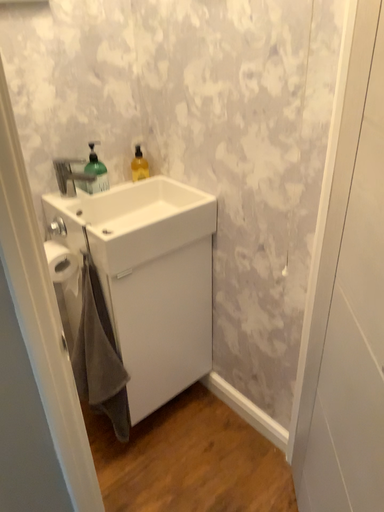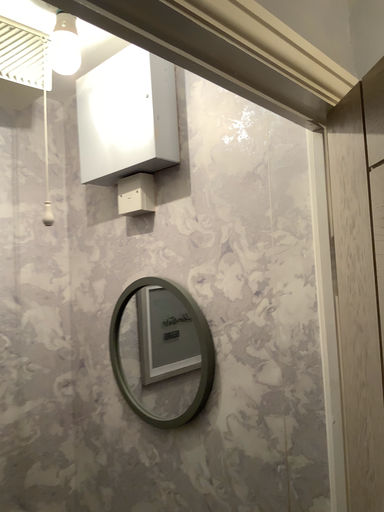
Question: How did the camera likely rotate when shooting the video?

Choices:
 (A) rotated upward
 (B) rotated downward

Answer: (A)